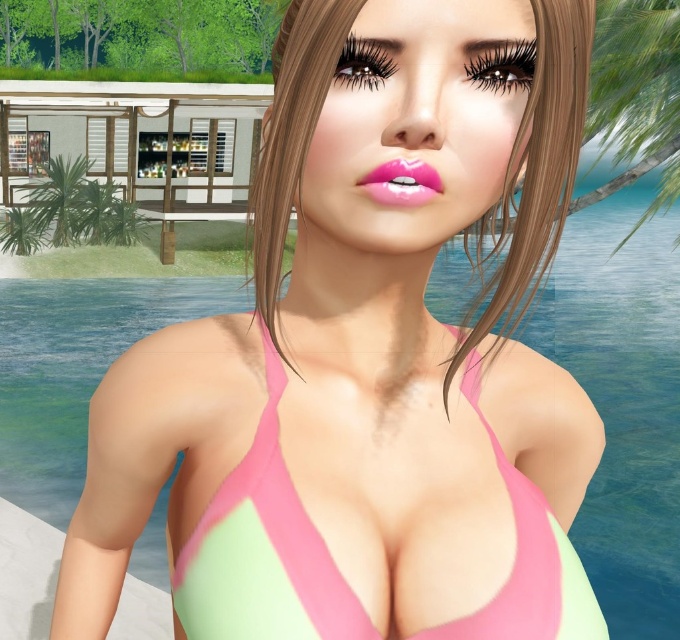
You are a photographer trying to capture the perfect shot of the two points in the image. To ensure both points are in focus, you need to know their relative positions. Which point is farther from the camera, the point at coordinates point (x=562, y=129) or point (x=409, y=166)?

Point (x=562, y=129) is behind point (x=409, y=166), so it is farther from the camera.

You are standing in the tropical resort scene and want to place a small decoration between the two points, point (530, 493) and point (509, 310). Which point should the decoration be closer to in order to appear closer to the viewer?

The decoration should be closer to point (530, 493) because it is further to the viewer than point (509, 310).

You are a photographer taking a portrait of the person in the swimsuit. You need to ensure that both the pink matte bikini top at center and the glossy pink lips at center are clearly visible in the frame. Based on their positions, which object is located to the left of the other?

The pink matte bikini top at center is positioned on the left side of glossy pink lips at center, so the bikini top is to the left of the lips.